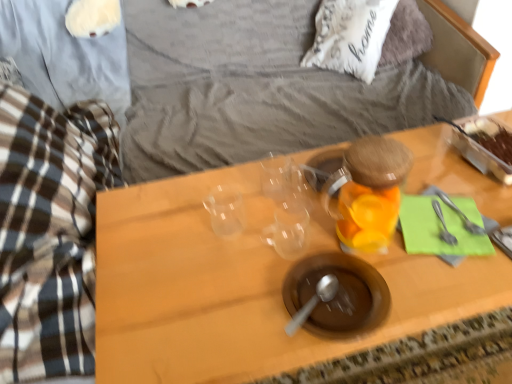
Question: Is silver metallic fork at right, which is the second silverware in right-to-left order, not close to white soft pillow at upper center?

Choices:
 (A) no
 (B) yes

Answer: (B)

Question: Does silver metallic fork at right, which is the second silverware in right-to-left order, have a lesser width compared to white soft pillow at upper center?

Choices:
 (A) yes
 (B) no

Answer: (A)

Question: Considering the relative positions of silver metallic fork at right, which ranks as the 1th silverware in left-to-right order, and white soft pillow at upper center in the image provided, is silver metallic fork at right, which ranks as the 1th silverware in left-to-right order, to the left of white soft pillow at upper center from the viewer's perspective?

Choices:
 (A) no
 (B) yes

Answer: (B)

Question: Considering the relative sizes of silver metallic fork at right, which ranks as the 1th silverware in left-to-right order, and white soft pillow at upper center in the image provided, is silver metallic fork at right, which ranks as the 1th silverware in left-to-right order, wider than white soft pillow at upper center?

Choices:
 (A) no
 (B) yes

Answer: (A)

Question: Does silver metallic fork at right, which ranks as the 1th silverware in left-to-right order, lie behind white soft pillow at upper center?

Choices:
 (A) yes
 (B) no

Answer: (B)

Question: Would you say silver metallic fork at right, which is the 1th silverware from right to left, is to the left or to the right of transparent plastic cups at center in the picture?

Choices:
 (A) left
 (B) right

Answer: (B)

Question: From the image's perspective, relative to transparent plastic cups at center, is silver metallic fork at right, the second silverware positioned from the left, above or below?

Choices:
 (A) above
 (B) below

Answer: (A)

Question: Considering the positions of silver metallic fork at right, the second silverware positioned from the left, and transparent plastic cups at center in the image, is silver metallic fork at right, the second silverware positioned from the left, bigger or smaller than transparent plastic cups at center?

Choices:
 (A) small
 (B) big

Answer: (A)

Question: Is silver metallic fork at right, which is the 1th silverware from right to left, wider or thinner than transparent plastic cups at center?

Choices:
 (A) thin
 (B) wide

Answer: (A)

Question: Which is correct: white soft pillow at upper center is inside brown matte bowl at center, or outside of it?

Choices:
 (A) outside
 (B) inside

Answer: (A)

Question: Is white soft pillow at upper center in front of or behind brown matte bowl at center in the image?

Choices:
 (A) front
 (B) behind

Answer: (B)

Question: From the image's perspective, is white soft pillow at upper center positioned above or below brown matte bowl at center?

Choices:
 (A) below
 (B) above

Answer: (B)

Question: In terms of size, does white soft pillow at upper center appear bigger or smaller than brown matte bowl at center?

Choices:
 (A) big
 (B) small

Answer: (A)

Question: From a real-world perspective, is transparent glass jar at center-right positioned above or below transparent plastic cups at center?

Choices:
 (A) above
 (B) below

Answer: (A)

Question: Considering the positions of transparent glass jar at center-right and transparent plastic cups at center in the image, is transparent glass jar at center-right taller or shorter than transparent plastic cups at center?

Choices:
 (A) short
 (B) tall

Answer: (A)